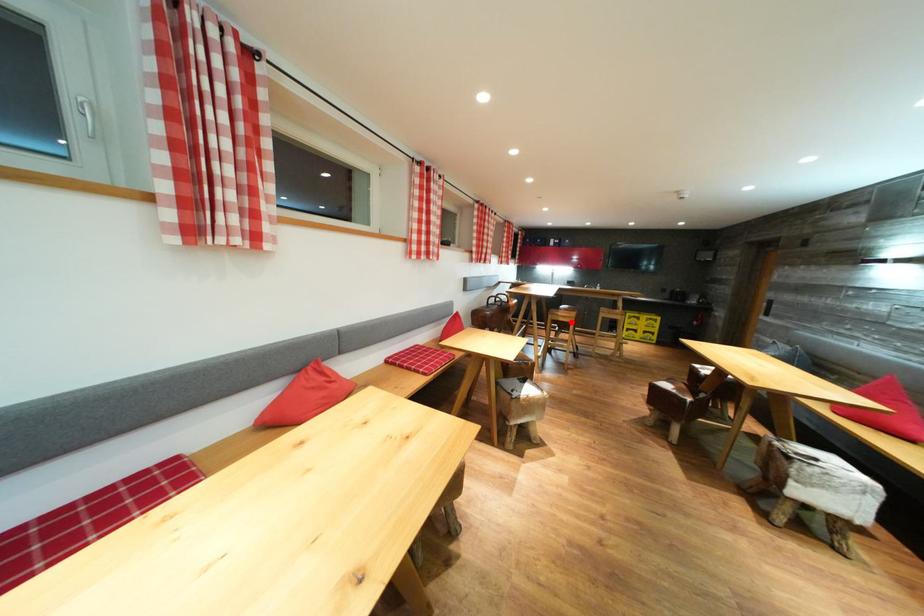
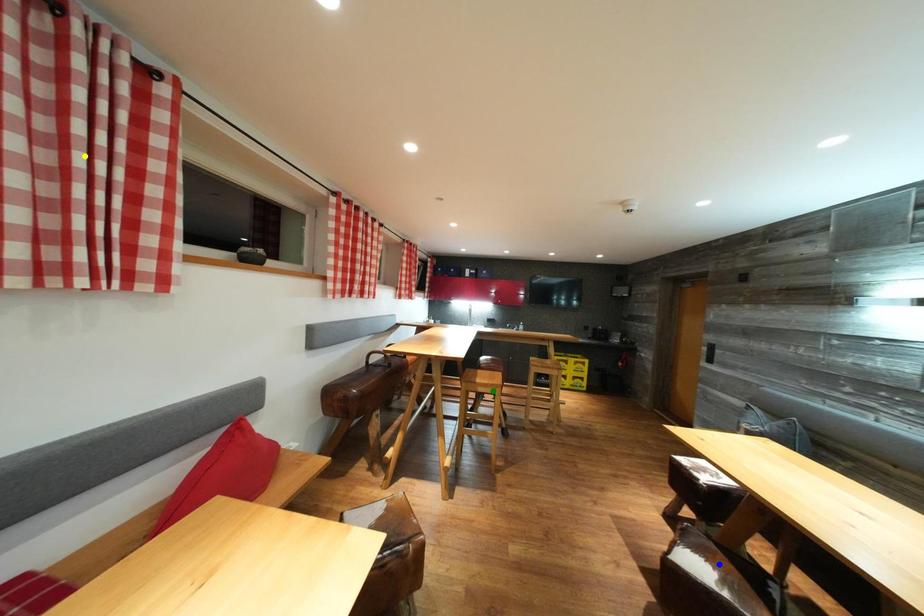
Question: I am providing you with two images of the same scene from different viewpoints. A red point is marked on the first image. You are given multiple points on the second image. Which point in image 2 is actually the same real-world point as the red point in image 1?

Choices:
 (A) green point
 (B) yellow point
 (C) blue point

Answer: (A)